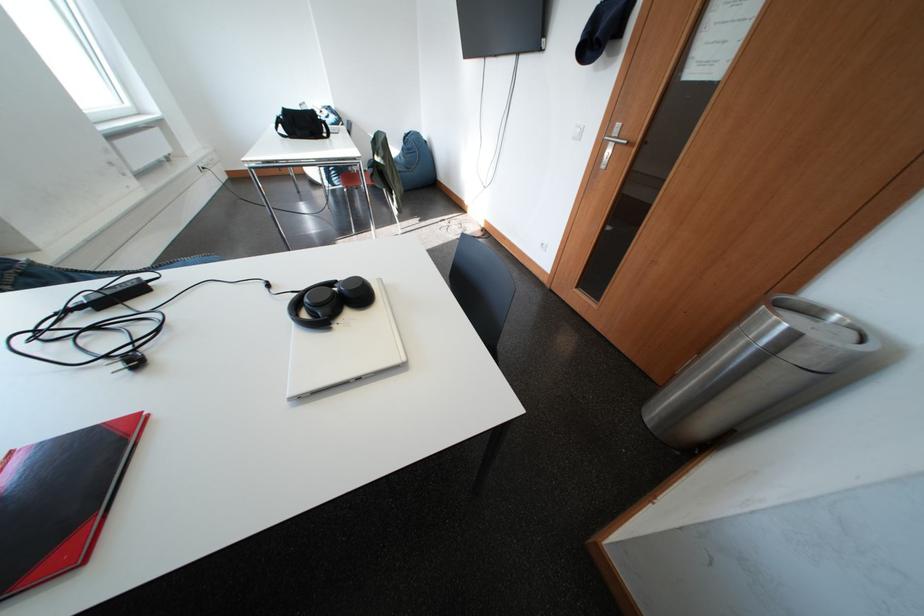
Identify the location of chair sitting surface. (x=358, y=172).